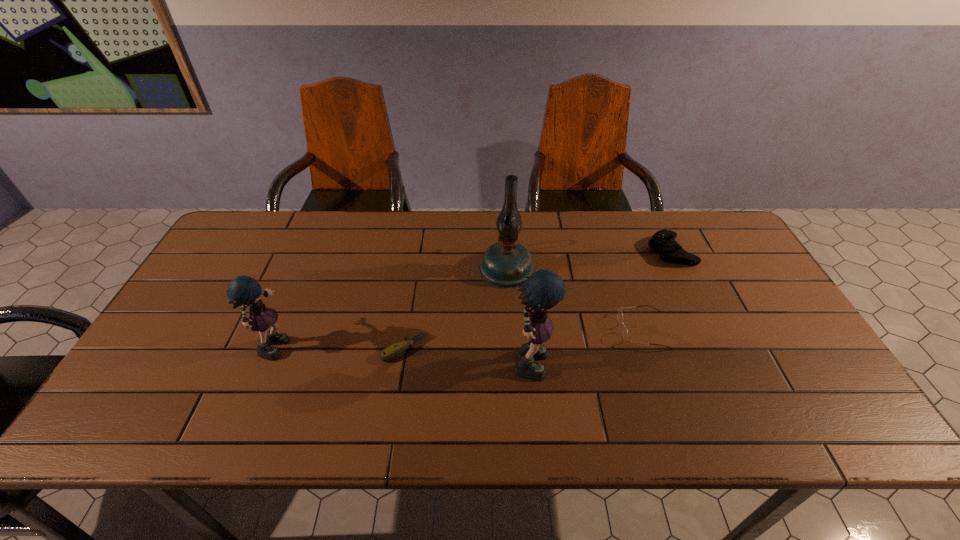
At what (x,y) coordinates should I click in order to perform the action: click on the shorter rag doll. Please return your answer as a coordinate pair (x, y). This screenshot has width=960, height=540. Looking at the image, I should click on (245, 290).

Where is `the leftmost object`? Image resolution: width=960 pixels, height=540 pixels. the leftmost object is located at coordinates (245, 290).

You are a GUI agent. You are given a task and a screenshot of the screen. Output one action in this format:
    pyautogui.click(x=<x>, y=<y>)
    Task: Click on the right rag doll
    
    Given the screenshot: What is the action you would take?
    pyautogui.click(x=544, y=289)

Locate an element on the screen. the third shortest object is located at coordinates (663, 241).

Find the location of `the rightmost object`. the rightmost object is located at coordinates (663, 241).

Locate an element on the screen. The width and height of the screenshot is (960, 540). oil lamp is located at coordinates (505, 264).

Locate an element on the screen. spectacles is located at coordinates (620, 316).

In order to click on the second shortest object in this screenshot , I will do `click(620, 316)`.

The height and width of the screenshot is (540, 960). What are the coordinates of `pocketknife` in the screenshot? It's located at (397, 348).

Where is `the fifth object from right to left`? The height and width of the screenshot is (540, 960). the fifth object from right to left is located at coordinates (397, 348).